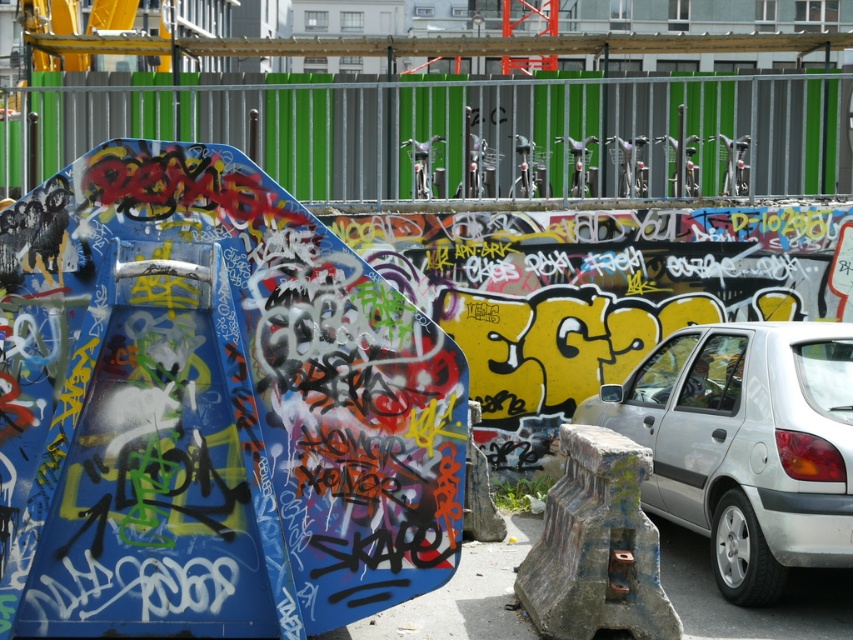
Measure the distance between metallic silver fence at upper center and silver metallic car at right.

They are 8.08 meters apart.

Is metallic silver fence at upper center in front of silver metallic car at right?

No, it is behind silver metallic car at right.

Between point (596, 170) and point (648, 492), which one is positioned behind?

Positioned behind is point (596, 170).

Find the location of a particular element. This screenshot has width=853, height=640. metallic silver fence at upper center is located at coordinates (460, 131).